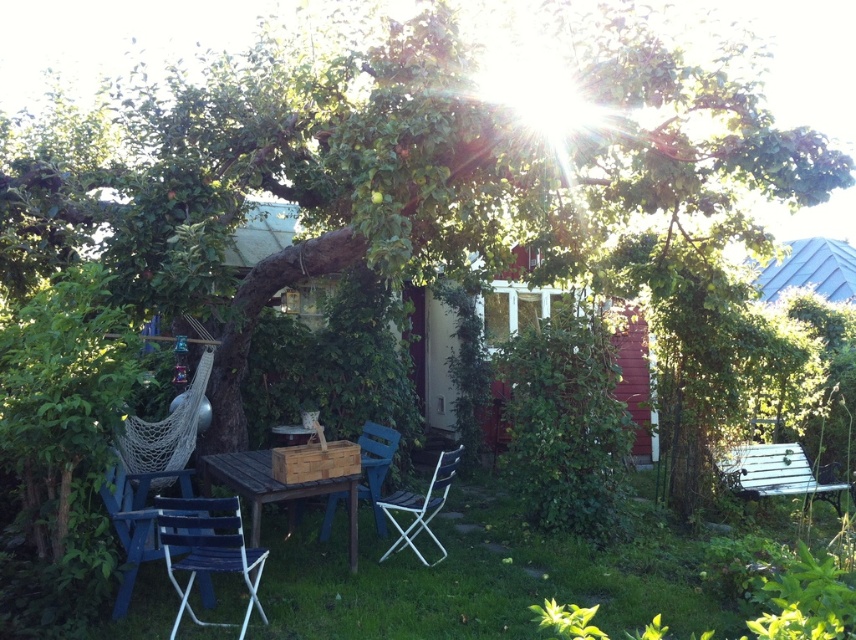
You are planning to set up a small garden party and need to place a table between the wooden hut at center and the blue wood chair at center. Based on their positions, which object should the table be closer to?

The wooden hut at center is above the blue wood chair at center, so the table should be placed closer to the blue wood chair at center to maintain a clear path between them.

You are planning to set up a small garden party and need to know if the blue wood chair at lower left can fit under the blue corrugated metal hut at upper right without touching the roof. Can you determine if there is enough vertical space?

The blue wood chair at lower left is shorter than the blue corrugated metal hut at upper right, so there is enough vertical space for the chair to fit under the hut without touching the roof.